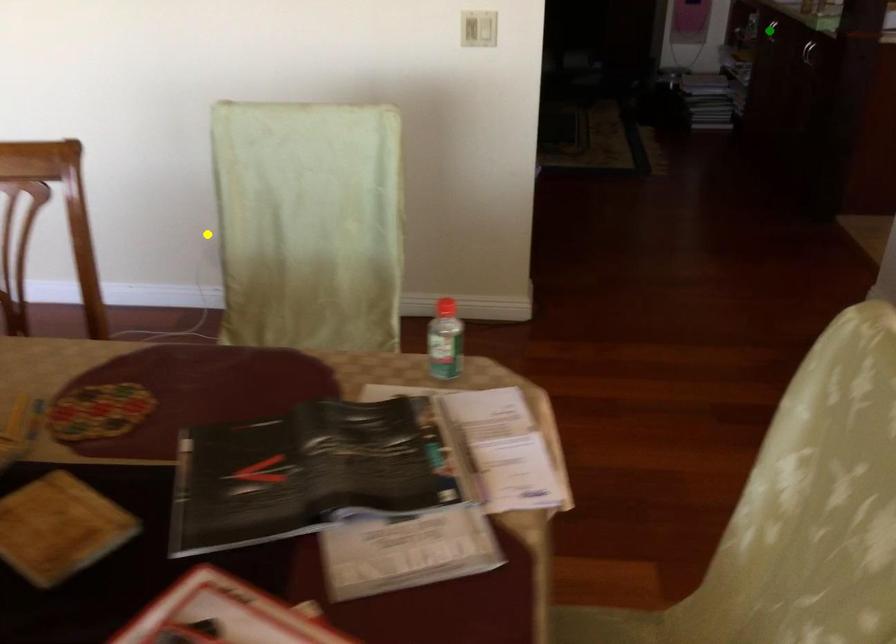
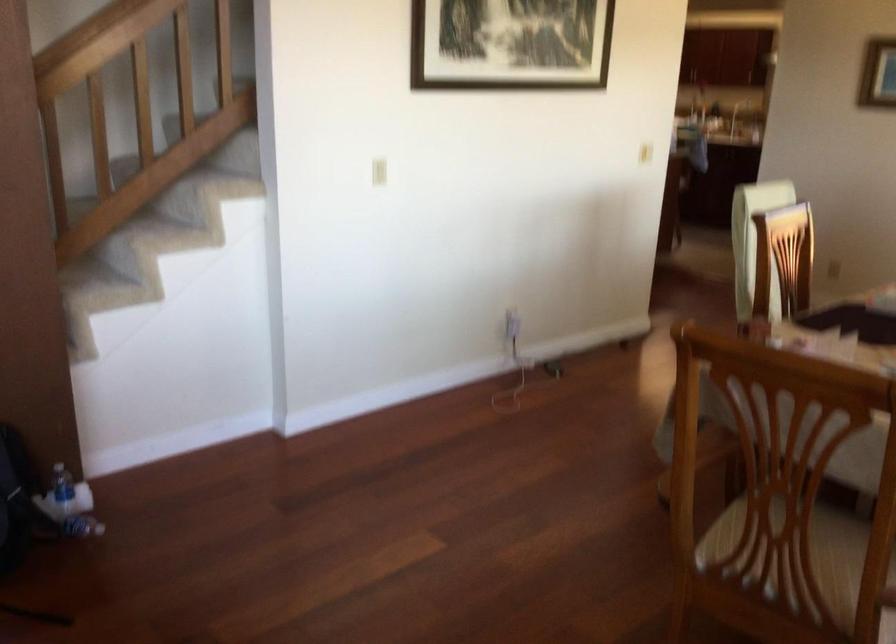
I am providing you with two images of the same scene from different viewpoints. Three points are marked in image1. Which point corresponds to a part or object that is occluded in image2?In image1, three points are marked. Which of them correspond to a part or object that is occluded in image2?Among the three points shown in image1, which one corresponds to a part or object that is no longer visible due to occlusion in image2?

green point